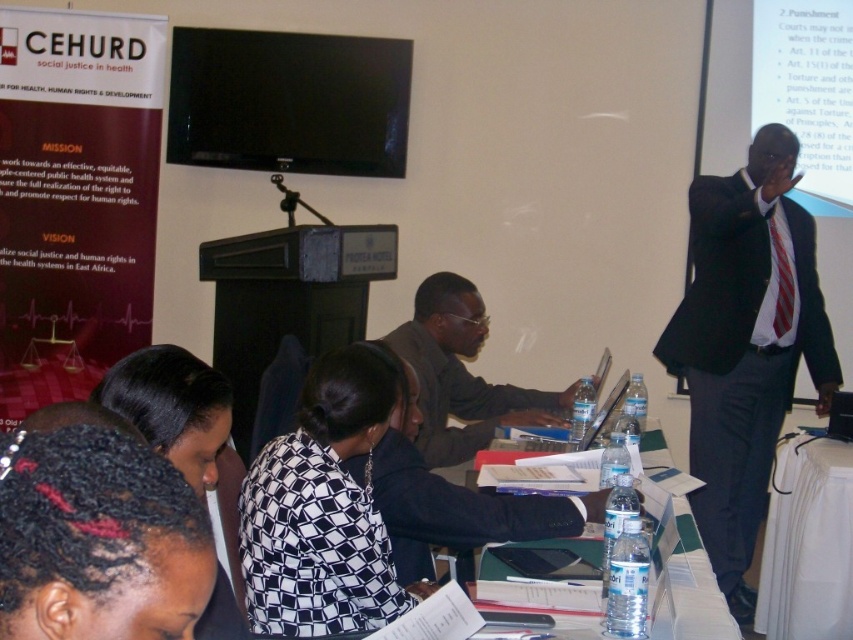
Question: Among these points, which one is farthest from the camera?

Choices:
 (A) (810, 291)
 (B) (395, 342)
 (C) (775, 516)
 (D) (680, 524)

Answer: (A)

Question: Is dark suit at right positioned at the back of white fabric table at lower right?

Choices:
 (A) no
 (B) yes

Answer: (B)

Question: Is matte gray shirt at center positioned before clear plastic water bottles at lower center?

Choices:
 (A) yes
 (B) no

Answer: (B)

Question: Considering the real-world distances, which object is farthest from the white fabric table at lower right?

Choices:
 (A) clear plastic water bottles at lower center
 (B) matte gray shirt at center
 (C) dark suit at right

Answer: (B)

Question: From the image, what is the correct spatial relationship of dark suit at right in relation to white fabric table at lower right?

Choices:
 (A) above
 (B) below

Answer: (A)

Question: Estimate the real-world distances between objects in this image. Which object is closer to the matte gray shirt at center?

Choices:
 (A) white fabric table at lower right
 (B) dark suit at right
 (C) clear plastic water bottles at lower center

Answer: (C)